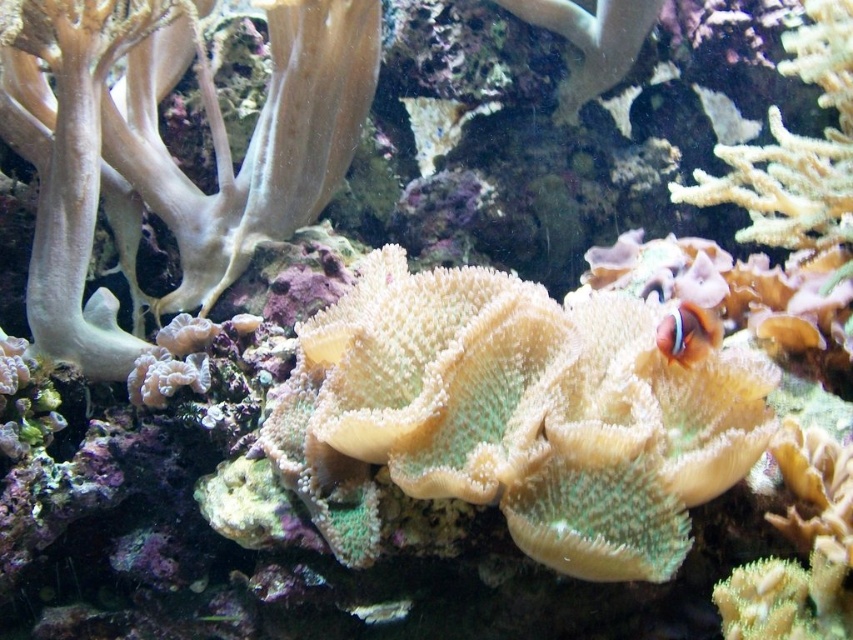
Can you confirm if soft coral at center is thinner than orange and white striped fish at center-right?

No.

You are a GUI agent. You are given a task and a screenshot of the screen. Output one action in this format:
    pyautogui.click(x=<x>, y=<y>)
    Task: Click on the soft coral at center
    
    Given the screenshot: What is the action you would take?
    pyautogui.click(x=521, y=412)

At what (x,y) coordinates should I click in order to perform the action: click on soft coral at center. Please return your answer as a coordinate pair (x, y). Looking at the image, I should click on (521, 412).